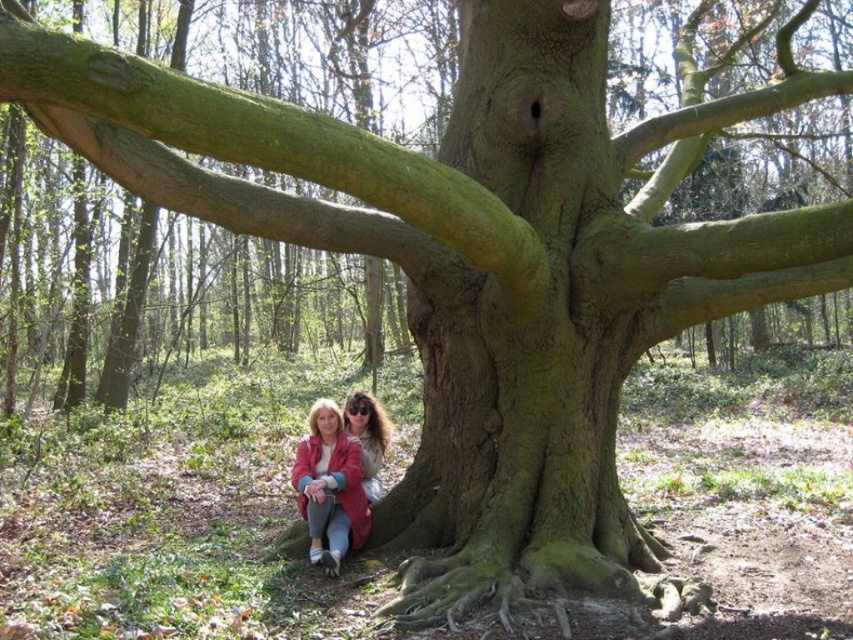
Can you confirm if matte pink coat at lower center is shorter than matte pink jacket at lower center?

No.

How distant is matte pink coat at lower center from matte pink jacket at lower center?

matte pink coat at lower center and matte pink jacket at lower center are 12.70 inches apart.

Identify the location of matte pink coat at lower center. This screenshot has height=640, width=853. (329, 486).

The image size is (853, 640). I want to click on matte pink coat at lower center, so pos(329,486).